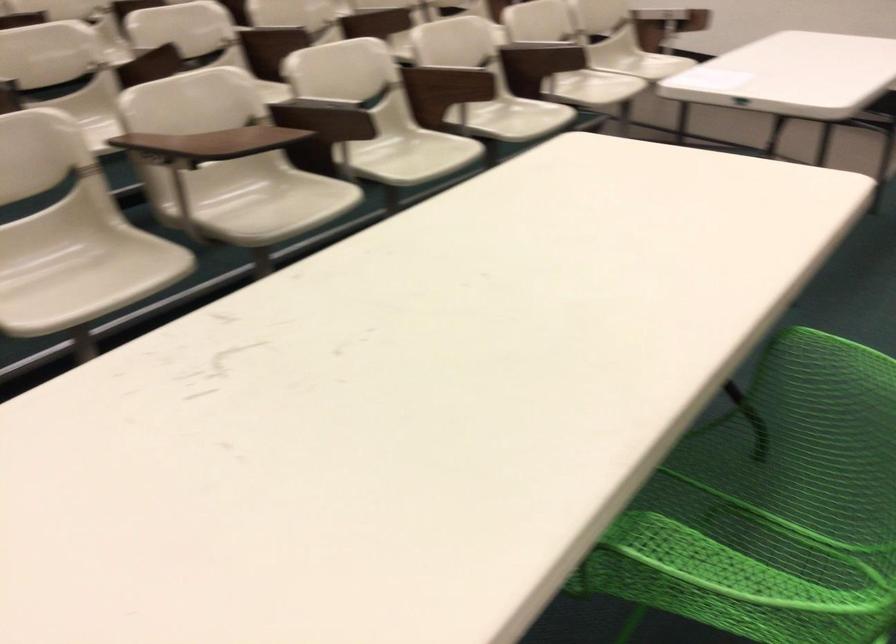
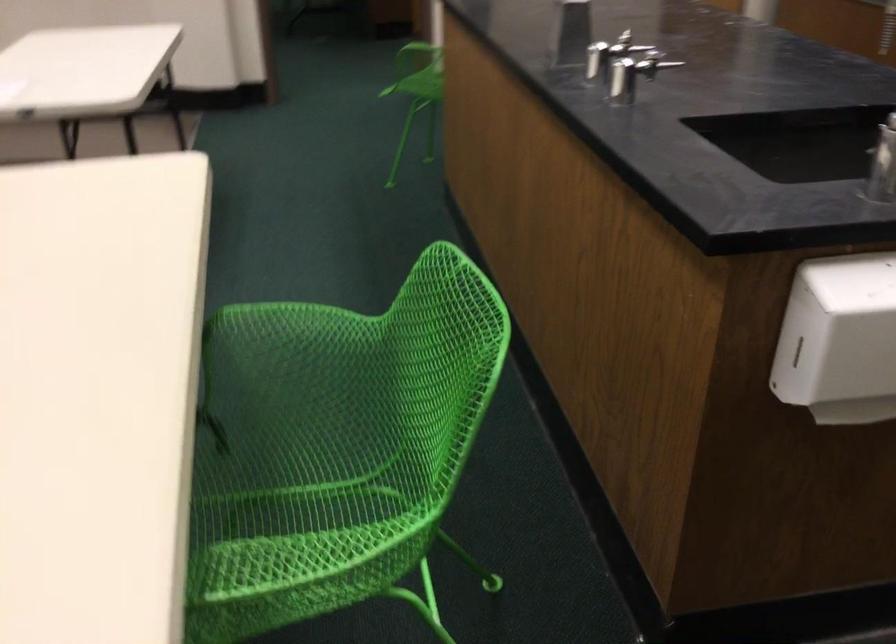
Question: How did the camera likely rotate?

Choices:
 (A) Left
 (B) Right
 (C) Up
 (D) Down

Answer: (B)